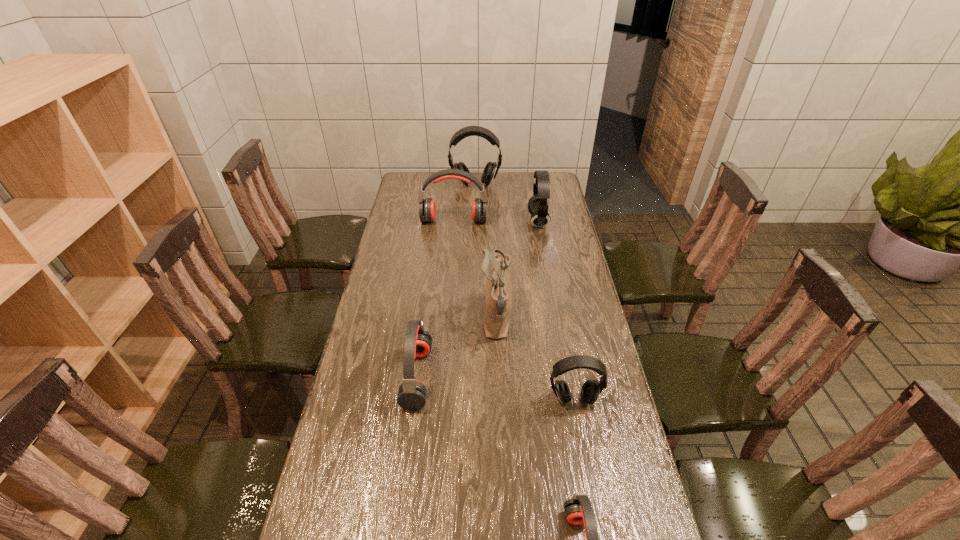
Image resolution: width=960 pixels, height=540 pixels. Find the location of `free space located on the front-facing side of the tan shoulder bag`. free space located on the front-facing side of the tan shoulder bag is located at coordinates (446, 319).

The image size is (960, 540). Identify the location of vacant area located 0.240m on the ear cups of the biggest red earphone. (450, 260).

Identify the location of vacant space located 0.140m on the ear cups of the second farthest black earphone. The height and width of the screenshot is (540, 960). (497, 221).

The height and width of the screenshot is (540, 960). Find the location of `free region located on the ear cups of the second farthest black earphone`. free region located on the ear cups of the second farthest black earphone is located at coordinates (477, 221).

At what (x,y) coordinates should I click in order to perform the action: click on free location located on the ear cups of the second farthest black earphone. Please return your answer as a coordinate pair (x, y). Image resolution: width=960 pixels, height=540 pixels. Looking at the image, I should click on (470, 221).

Locate an element on the screen. Image resolution: width=960 pixels, height=540 pixels. free point located on the ear cups of the second biggest red earphone is located at coordinates (494, 377).

The height and width of the screenshot is (540, 960). In order to click on vacant space located 0.080m on the ear cups of the nearest black earphone in this screenshot , I will do `click(581, 435)`.

Locate an element on the screen. This screenshot has height=540, width=960. object that is positioned at the far edge is located at coordinates (491, 169).

Locate an element on the screen. object at the left edge is located at coordinates (427, 212).

Locate an element on the screen. free spot at the far edge of the desktop is located at coordinates (454, 188).